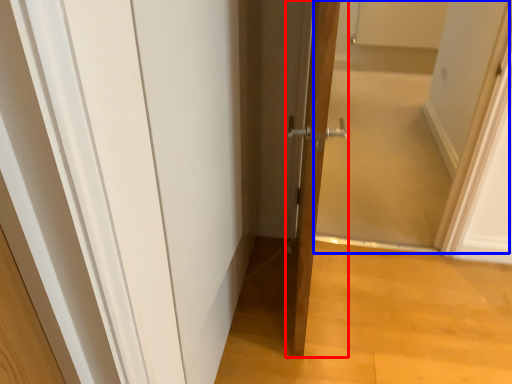
Question: Which object appears closest to the camera in this image, door (highlighted by a red box) or screen door (highlighted by a blue box)?

Choices:
 (A) door
 (B) screen door

Answer: (A)